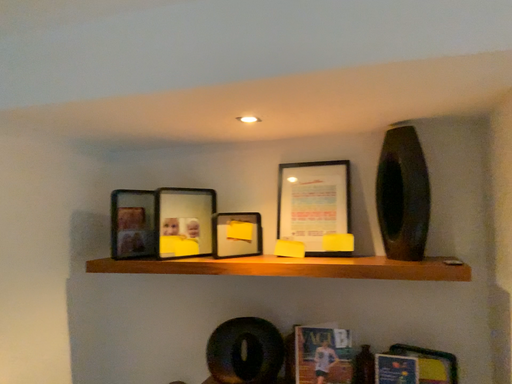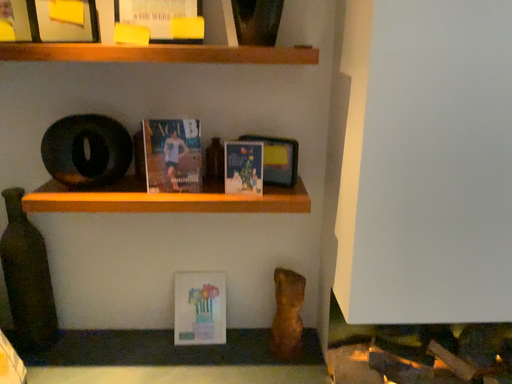
Question: Which way did the camera rotate in the video?

Choices:
 (A) rotated right
 (B) rotated left

Answer: (A)